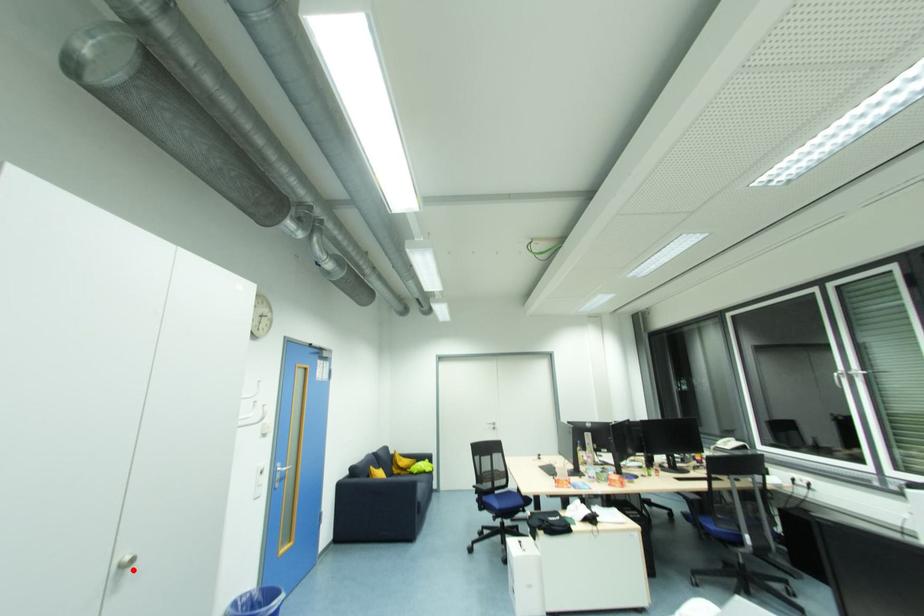
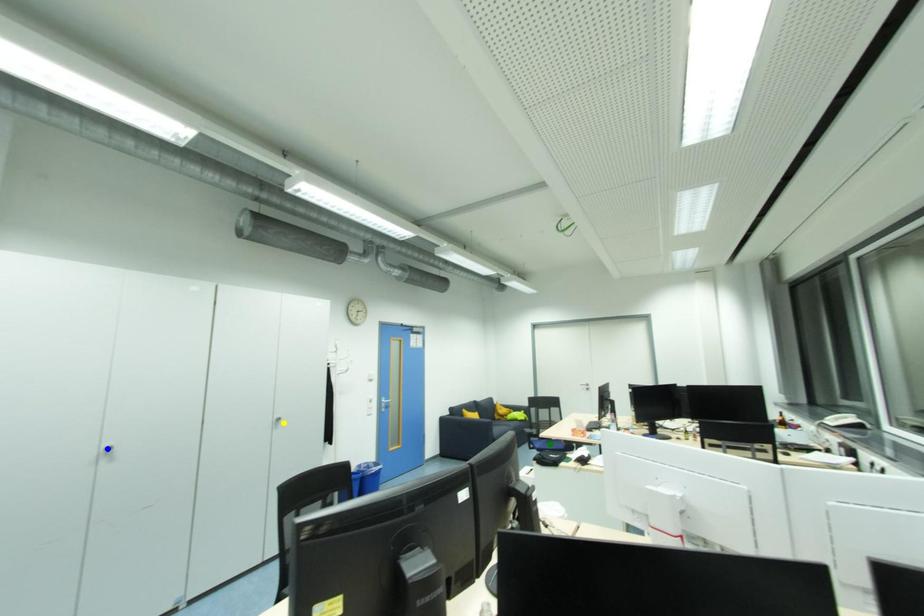
Question: I am providing you with two images of the same scene from different viewpoints. A red point is marked on the first image. You are given multiple points on the second image. Which spot in image 2 lines up with the point in image 1?

Choices:
 (A) green point
 (B) blue point
 (C) yellow point

Answer: (C)